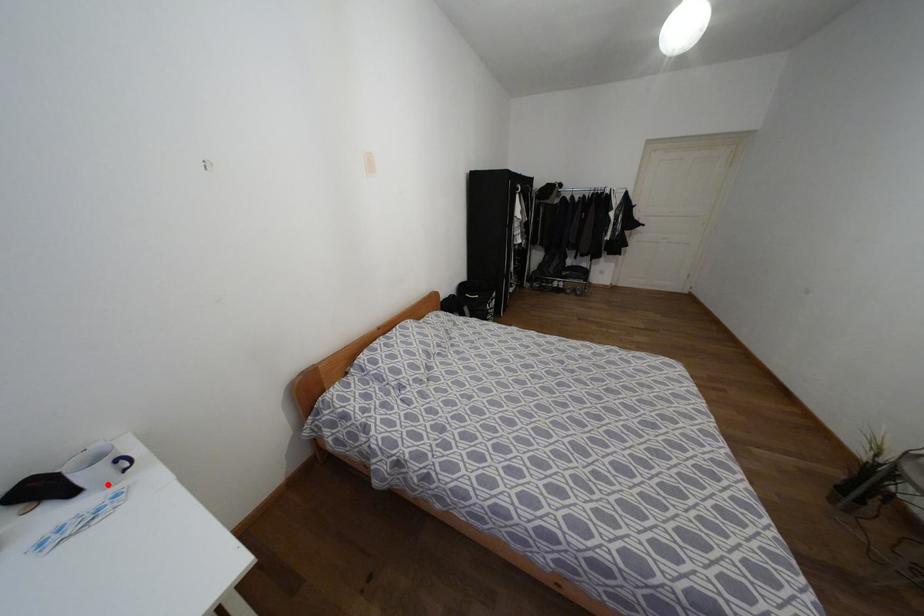
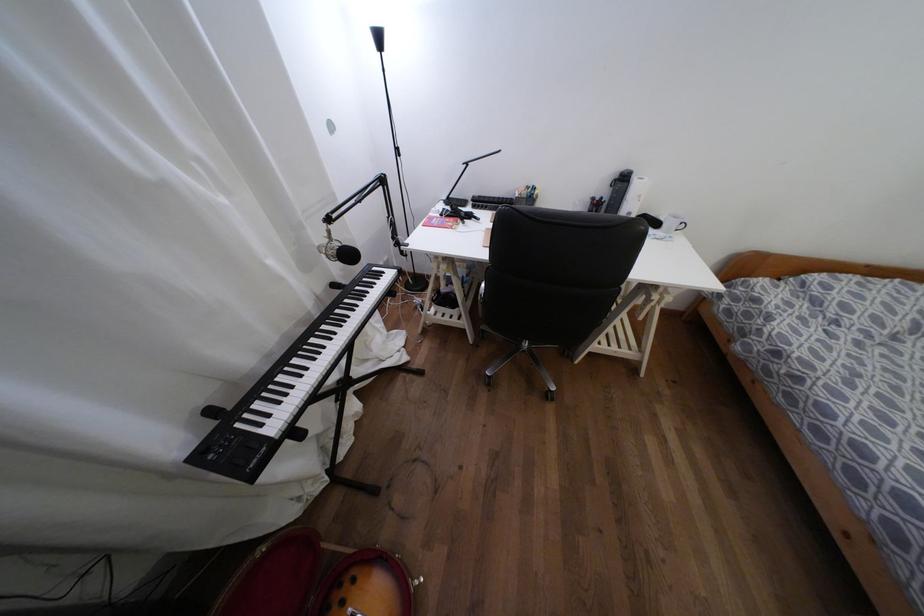
Question: I am providing you with two images of the same scene from different viewpoints. Image1 has a red point marked. In image2, the corresponding 3D location appears at what relative position? Reply with the corresponding letter.

Choices:
 (A) Closer
 (B) Farther

Answer: (B)